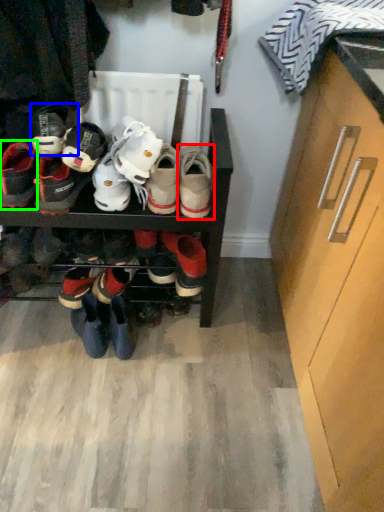
Question: Which object is positioned closest to footwear (highlighted by a red box)? Select from footwear (highlighted by a blue box) and footwear (highlighted by a green box).

Choices:
 (A) footwear
 (B) footwear

Answer: (A)